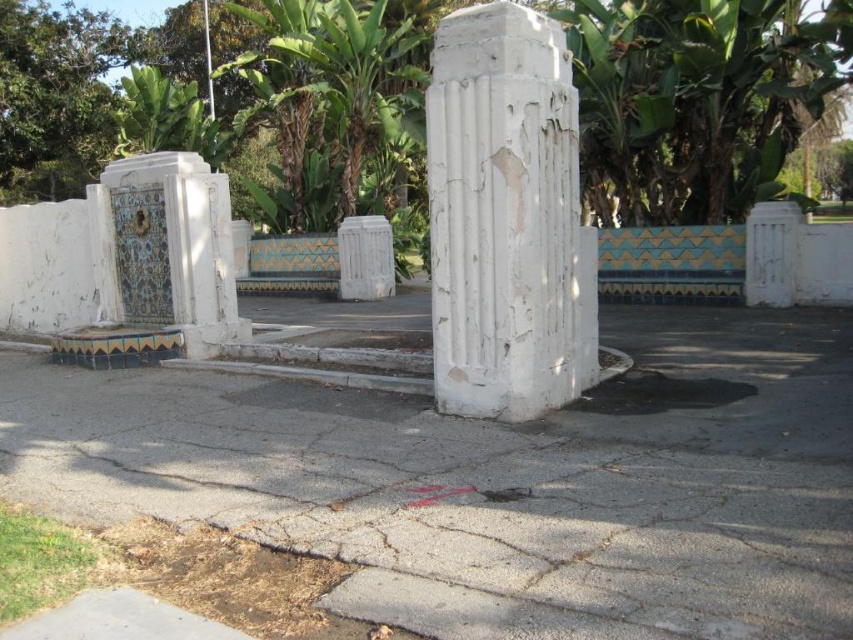
Question: Can you confirm if gray asphalt pavement at center is wider than white cracked concrete column at center?

Choices:
 (A) no
 (B) yes

Answer: (B)

Question: Can you confirm if gray asphalt pavement at center is positioned below white cracked concrete column at center?

Choices:
 (A) no
 (B) yes

Answer: (B)

Question: Among these points, which one is farthest from the camera?

Choices:
 (A) (508, 406)
 (B) (302, 412)

Answer: (B)

Question: Can you confirm if gray asphalt pavement at center is wider than white cracked concrete column at center?

Choices:
 (A) no
 (B) yes

Answer: (B)